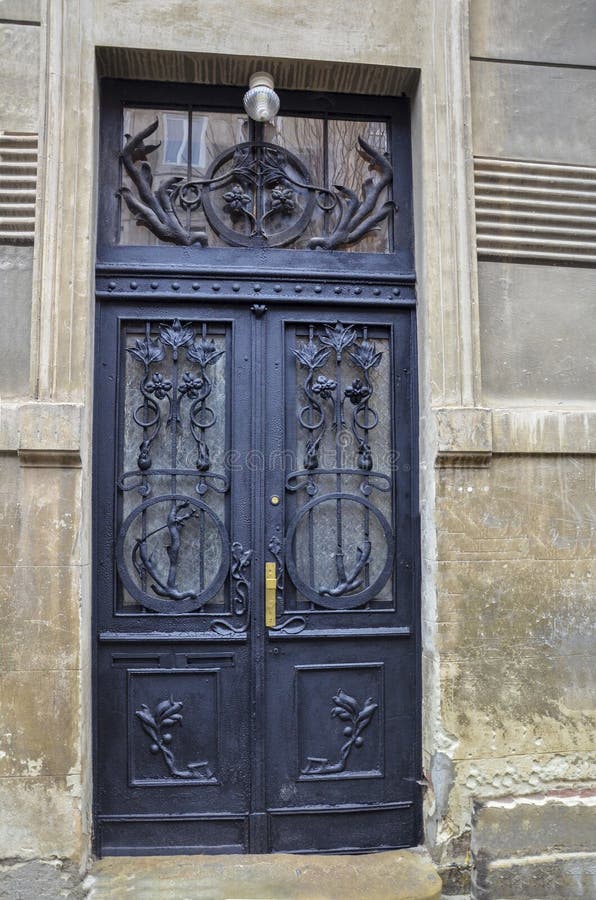
This screenshot has height=900, width=596. In order to click on light in this screenshot , I will do `click(265, 104)`.